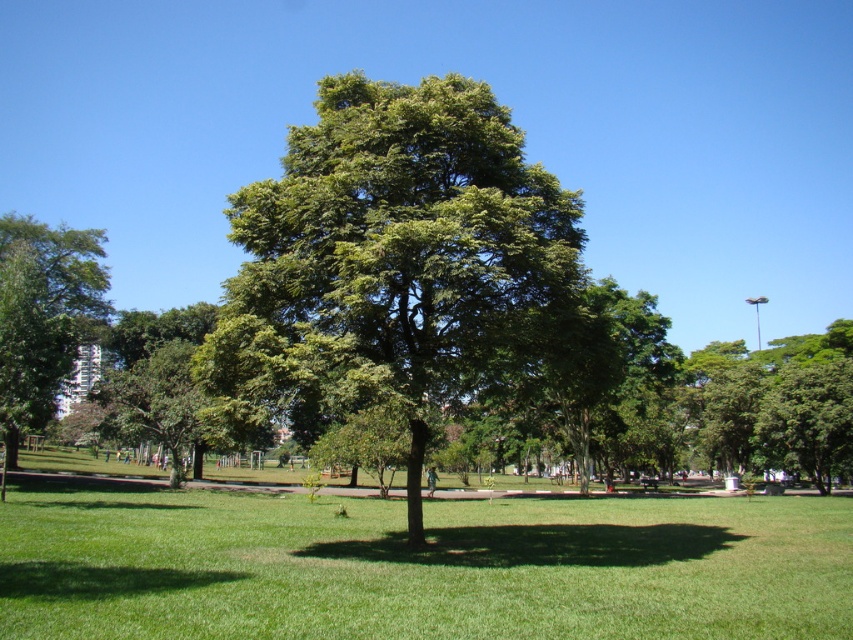
Who is taller, green grass at center or green leafy tree at center?

green leafy tree at center is taller.

Which of these two, green grass at center or green leafy tree at center, stands shorter?

green grass at center is shorter.

Find the location of `green grass at center`. green grass at center is located at coordinates (421, 566).

Is green leafy tree at center further to the viewer compared to green leafy tree at left?

No.

Locate an element on the screen. green leafy tree at center is located at coordinates (392, 260).

Looking at this image, which is more to the left, green grass at center or green leafy tree at left?

green leafy tree at left

Is green grass at center wider than green leafy tree at left?

Indeed, green grass at center has a greater width compared to green leafy tree at left.

At what (x,y) coordinates should I click in order to perform the action: click on green grass at center. Please return your answer as a coordinate pair (x, y). The image size is (853, 640). Looking at the image, I should click on (421, 566).